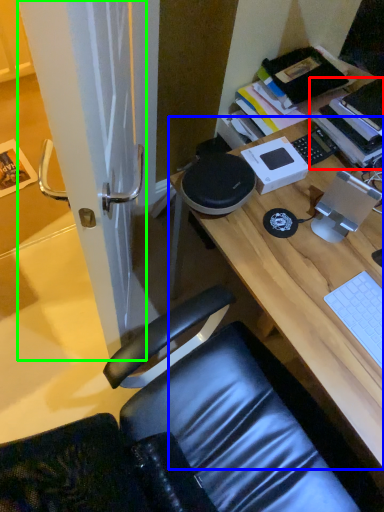
Question: Based on their relative distances, which object is nearer to book (highlighted by a red box)? Choose from desk (highlighted by a blue box) and screen door (highlighted by a green box).

Choices:
 (A) desk
 (B) screen door

Answer: (A)